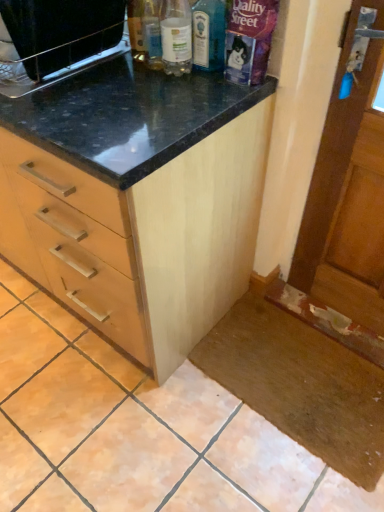
Question: Can you confirm if translucent glass bottle at center, placed as the second bottle when sorted from left to right, is smaller than clear plastic bottle at upper center, which ranks as the first bottle in left-to-right order?

Choices:
 (A) no
 (B) yes

Answer: (B)

Question: From the image's perspective, is translucent glass bottle at center, placed as the second bottle when sorted from left to right, above clear plastic bottle at upper center, the second bottle positioned from the right?

Choices:
 (A) no
 (B) yes

Answer: (A)

Question: Can you confirm if translucent glass bottle at center, placed as the second bottle when sorted from left to right, is bigger than clear plastic bottle at upper center, the second bottle positioned from the right?

Choices:
 (A) no
 (B) yes

Answer: (A)

Question: Can we say translucent glass bottle at center, the 1th bottle when ordered from right to left, lies outside clear plastic bottle at upper center, which ranks as the first bottle in left-to-right order?

Choices:
 (A) no
 (B) yes

Answer: (B)

Question: Does translucent glass bottle at center, the 1th bottle when ordered from right to left, have a greater height compared to clear plastic bottle at upper center, which ranks as the first bottle in left-to-right order?

Choices:
 (A) yes
 (B) no

Answer: (B)

Question: Is translucent glass bottle at center, placed as the second bottle when sorted from left to right, positioned before clear plastic bottle at upper center, the second bottle positioned from the right?

Choices:
 (A) yes
 (B) no

Answer: (B)

Question: Is clear plastic bottle at upper center, the second bottle positioned from the right, bigger than light wood cabinet at center?

Choices:
 (A) no
 (B) yes

Answer: (A)

Question: Is clear plastic bottle at upper center, the second bottle positioned from the right, at the right side of light wood cabinet at center?

Choices:
 (A) yes
 (B) no

Answer: (A)

Question: Is clear plastic bottle at upper center, which ranks as the first bottle in left-to-right order, aimed at light wood cabinet at center?

Choices:
 (A) yes
 (B) no

Answer: (B)

Question: Is clear plastic bottle at upper center, which ranks as the first bottle in left-to-right order, touching light wood cabinet at center?

Choices:
 (A) yes
 (B) no

Answer: (B)

Question: From a real-world perspective, is clear plastic bottle at upper center, the second bottle positioned from the right, located higher than light wood cabinet at center?

Choices:
 (A) yes
 (B) no

Answer: (A)

Question: From the image's perspective, is clear plastic bottle at upper center, the second bottle positioned from the right, under light wood cabinet at center?

Choices:
 (A) no
 (B) yes

Answer: (A)

Question: Does translucent glass bottle at center, the 1th bottle when ordered from right to left, have a lesser height compared to black matte microwave at upper left?

Choices:
 (A) yes
 (B) no

Answer: (B)